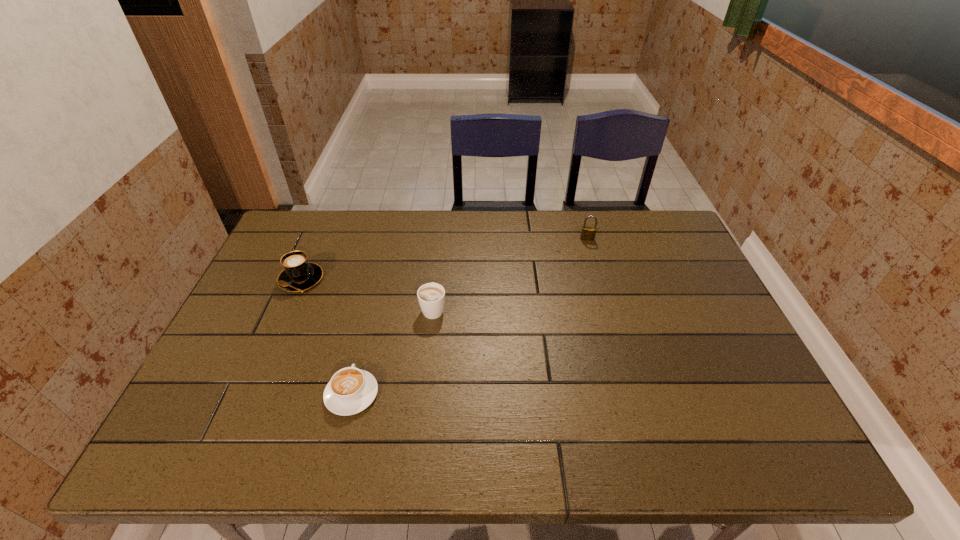
At what (x,y) coordinates should I click in order to perform the action: click on vacant space located 0.320m with the handle on the side of the second farthest cappuccino. Please return your answer as a coordinate pair (x, y). Looking at the image, I should click on (442, 230).

Where is `free space located with the handle on the side of the second farthest cappuccino`? The height and width of the screenshot is (540, 960). free space located with the handle on the side of the second farthest cappuccino is located at coordinates (443, 217).

I want to click on vacant space located with the handle on the side of the second farthest cappuccino, so click(x=438, y=266).

Where is `blank space located 0.400m on the side of the nearest cappuccino with the handle`? The width and height of the screenshot is (960, 540). blank space located 0.400m on the side of the nearest cappuccino with the handle is located at coordinates (383, 264).

You are a GUI agent. You are given a task and a screenshot of the screen. Output one action in this format:
    pyautogui.click(x=<x>, y=<y>)
    Task: Click on the free space located 0.060m on the side of the nearest cappuccino with the handle
    The width and height of the screenshot is (960, 540).
    Given the screenshot: What is the action you would take?
    pyautogui.click(x=362, y=352)

Where is `vacant space located 0.190m on the side of the nearest cappuccino with the handle`? This screenshot has width=960, height=540. vacant space located 0.190m on the side of the nearest cappuccino with the handle is located at coordinates 371,314.

What are the coordinates of `object located in the far edge section of the desktop` in the screenshot? It's located at (588, 233).

The image size is (960, 540). I want to click on object at the left edge, so click(x=298, y=274).

The width and height of the screenshot is (960, 540). What are the coordinates of `free spot at the far edge of the desktop` in the screenshot? It's located at (449, 242).

Find the location of a particular element. free space at the near edge of the desktop is located at coordinates (626, 438).